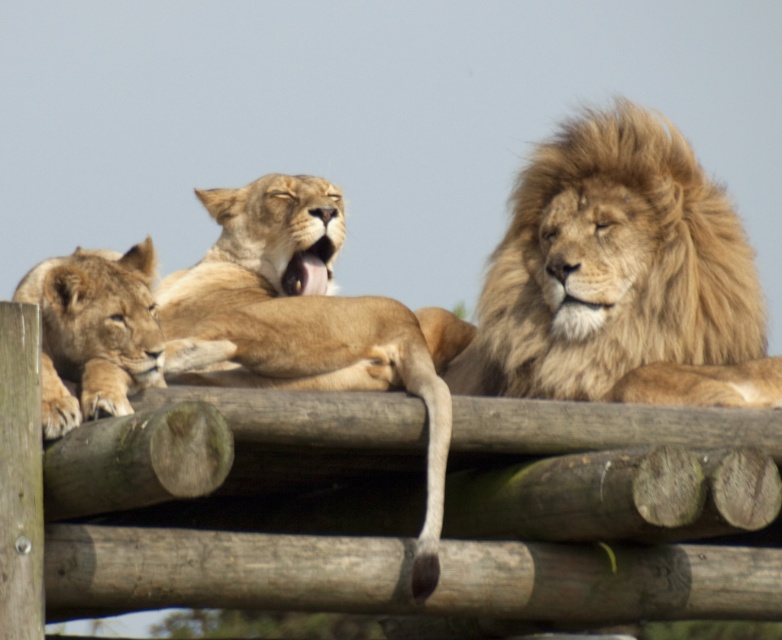
You are standing in front of the wooden structure where the golden fur lion at right is resting. If you want to take a photo of the lion, where should you position yourself relative to the structure?

The golden fur lion at right is located at coordinates 0.434 on the x and 0.794 on the y axis, so to take a photo of it, you should position yourself facing the structure near the right side, approximately 43.4 percent from the left edge and 79.4 percent from the bottom edge.

In the scene shown: You are designing a new enclosure for lions and need to ensure there is enough space between the golden fur lion at right and the golden fur lion at center. According to the scene, which lion requires more space horizontally?

The golden fur lion at center requires more horizontal space because its width is greater than the golden fur lion at right.

You are a zookeeper observing three lions on a wooden structure. You notice a point at coordinates (x=310, y=321). Which lion does this point correspond to?

The point at coordinates (x=310, y=321) corresponds to the golden fur lion at center.